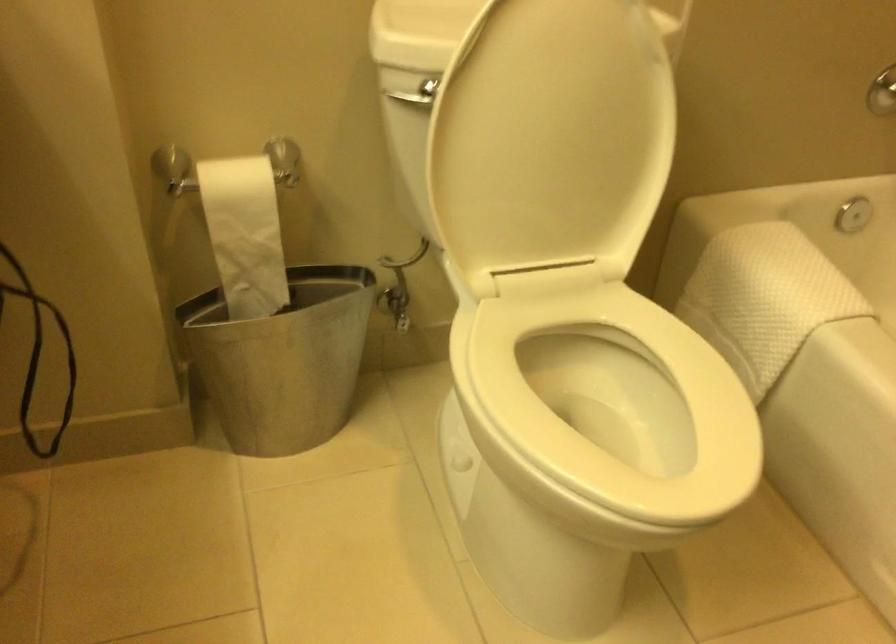
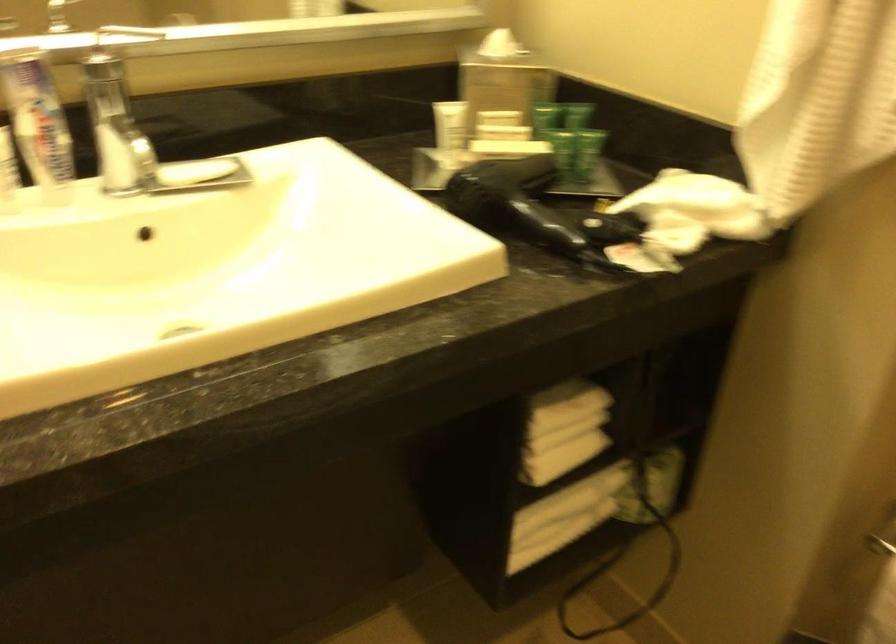
Question: How did the camera likely rotate?

Choices:
 (A) Left
 (B) Right
 (C) Up
 (D) Down

Answer: (A)